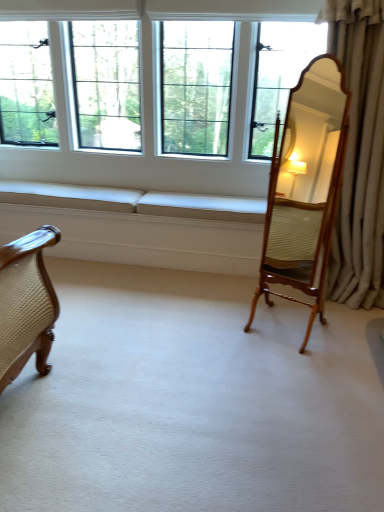
Question: From the image's perspective, does beige fabric couch at lower left appear lower than wooden mirror at right?

Choices:
 (A) no
 (B) yes

Answer: (B)

Question: Is beige fabric couch at lower left completely or partially outside of wooden mirror at right?

Choices:
 (A) yes
 (B) no

Answer: (A)

Question: Can you confirm if beige fabric couch at lower left is wider than wooden mirror at right?

Choices:
 (A) no
 (B) yes

Answer: (B)

Question: From a real-world perspective, is beige fabric couch at lower left located beneath wooden mirror at right?

Choices:
 (A) yes
 (B) no

Answer: (A)

Question: Is beige fabric couch at lower left at the right side of wooden mirror at right?

Choices:
 (A) yes
 (B) no

Answer: (B)

Question: Is the surface of beige fabric couch at lower left in direct contact with wooden mirror at right?

Choices:
 (A) yes
 (B) no

Answer: (B)

Question: Does wooden mirror at right lie in front of silky beige curtain at right?

Choices:
 (A) no
 (B) yes

Answer: (B)

Question: Considering the relative sizes of wooden mirror at right and silky beige curtain at right in the image provided, is wooden mirror at right smaller than silky beige curtain at right?

Choices:
 (A) no
 (B) yes

Answer: (B)

Question: Is silky beige curtain at right a part of wooden mirror at right?

Choices:
 (A) yes
 (B) no

Answer: (B)

Question: Does wooden mirror at right appear on the left side of silky beige curtain at right?

Choices:
 (A) no
 (B) yes

Answer: (B)

Question: From the image's perspective, would you say wooden mirror at right is positioned over silky beige curtain at right?

Choices:
 (A) no
 (B) yes

Answer: (A)

Question: From the image's perspective, does wooden mirror at right appear lower than silky beige curtain at right?

Choices:
 (A) no
 (B) yes

Answer: (B)

Question: From a real-world perspective, is wooden mirror at right located higher than clear glass windows at center?

Choices:
 (A) no
 (B) yes

Answer: (A)